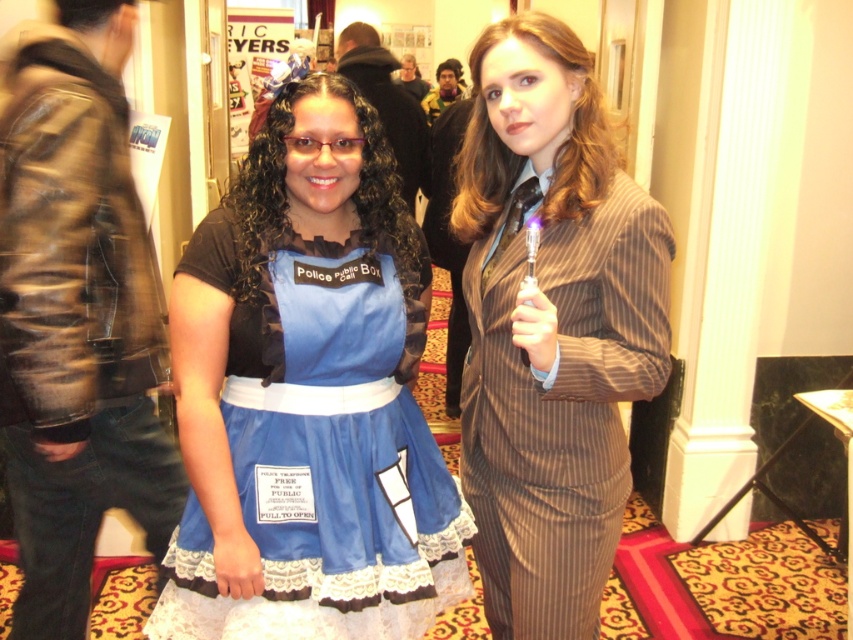
In the scene shown: You are organizing a costume party and need to arrange two dresses in a narrow hallway. The brown pinstripe dress at center and the matte black dress at center are both on display. Given their widths, which dress will require more space horizontally when placed side by side?

The matte black dress at center requires more space horizontally because its width is greater than the brown pinstripe dress at center.